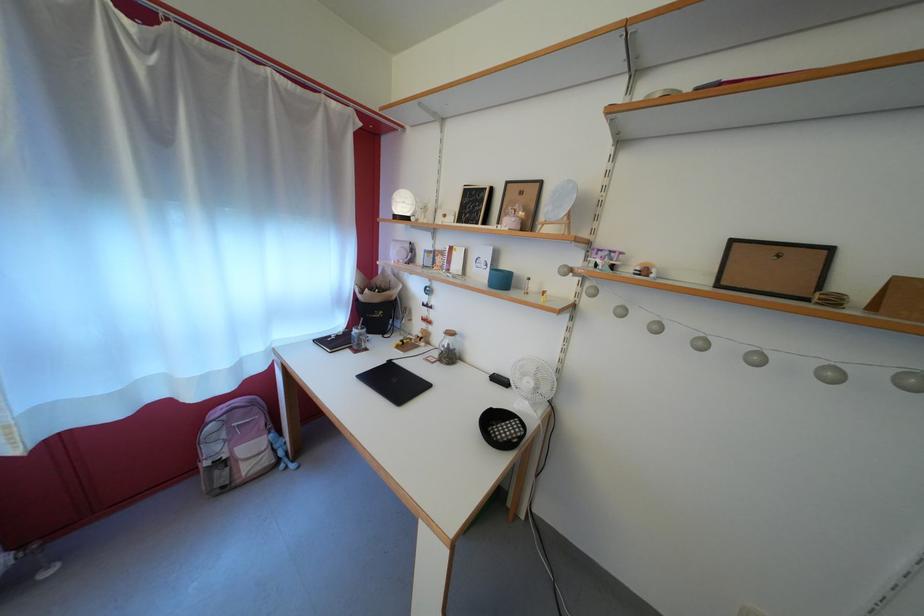
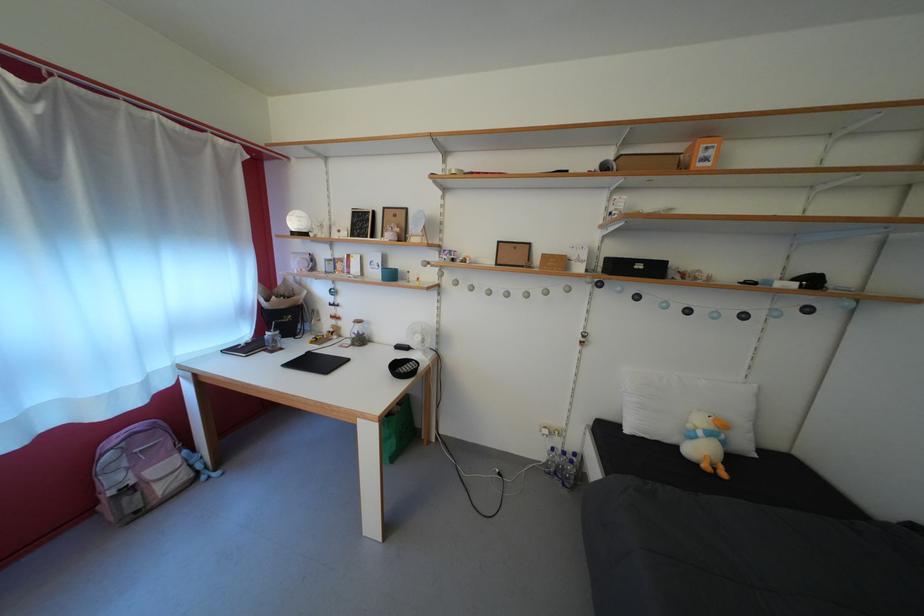
The point at (223, 456) is marked in the first image. Where is the corresponding point in the second image?

(123, 485)